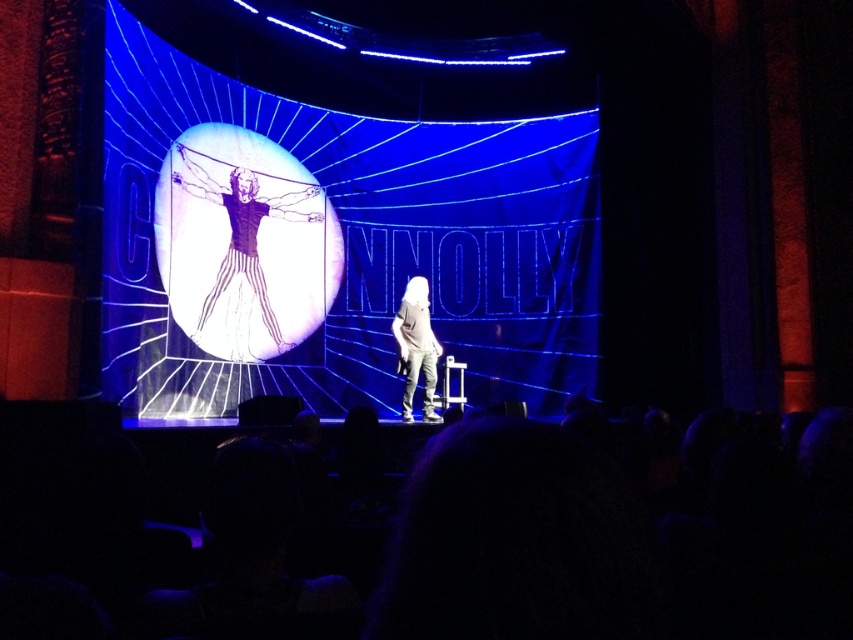
You are a stagehand standing at the back of the auditorium and need to adjust the lighting for the translucent white figure at center and the white cotton shirt at center. If your reach extends up to 14 meters, can you adjust both without using a ladder?

The distance between the translucent white figure at center and the white cotton shirt at center is 14.51 meters. Since your reach is only up to 14 meters, you cannot adjust both without a ladder.

In the scene shown: You are an event coordinator setting up for a presentation. You need to position a projector so that it faces the white matte screen at center and the translucent white figure at center. Since both are at the center, which one is to the right of the other?

The white matte screen at center is to the right of the translucent white figure at center.

Based on the photo, you are an event planner setting up for a presentation. You need to place a projector that can cover the entire white matte screen at center and the translucent white figure at center. Given that the projector can only project onto areas up to the size of the smaller object, will it be sufficient?

The white matte screen at center is larger than the translucent white figure at center. Since the projector can only cover up to the size of the smaller object, it will not be sufficient to cover the entire white matte screen at center.